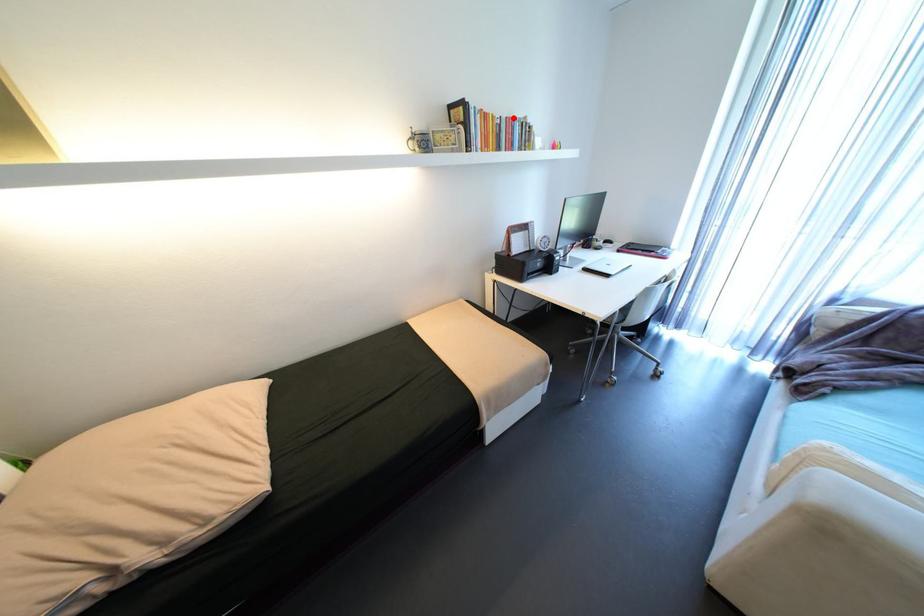
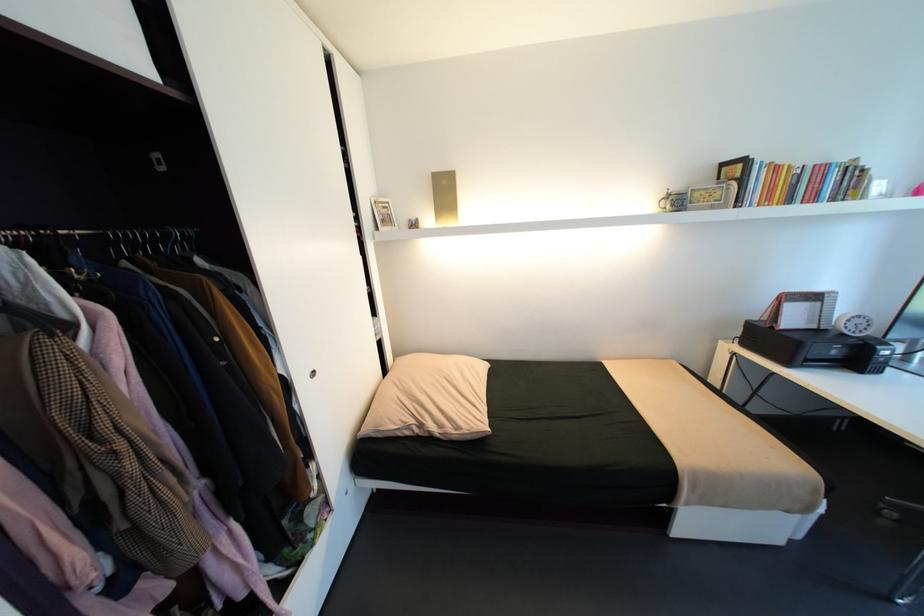
Question: A red point is marked in image1. In image2, is the corresponding 3D point closer to the camera or farther? Reply with the corresponding letter.

Choices:
 (A) The corresponding 3D point is closer.
 (B) The corresponding 3D point is farther.

Answer: (B)